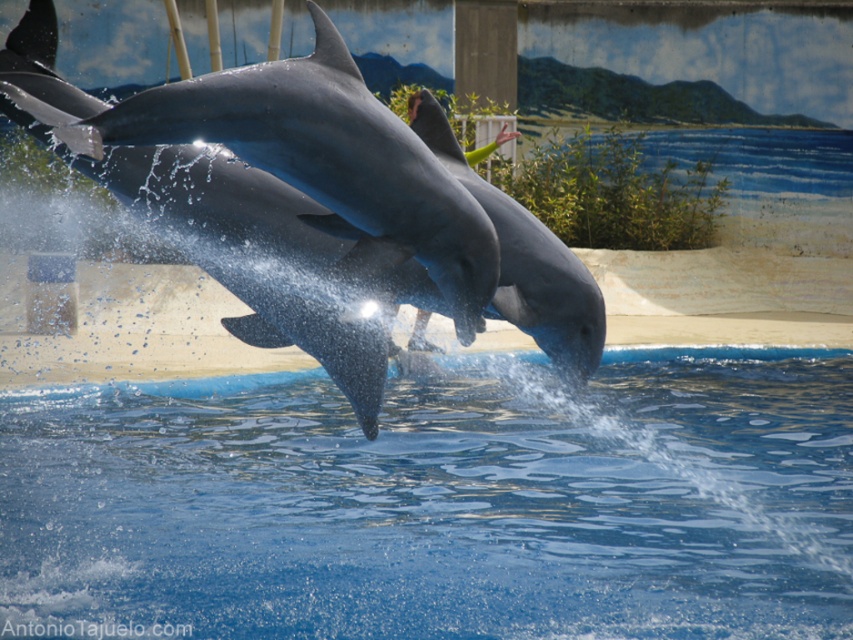
Question: Which point is farther from the camera taking this photo?

Choices:
 (A) (488, 188)
 (B) (143, 488)
 (C) (277, 131)

Answer: (B)

Question: Is blue smooth water at center to the left of shiny gray dolphin at center from the viewer's perspective?

Choices:
 (A) no
 (B) yes

Answer: (B)

Question: Estimate the real-world distances between objects in this image. Which object is closer to the shiny gray dolphin at center?

Choices:
 (A) blue smooth water at center
 (B) gray smooth dolphin at center

Answer: (B)

Question: Does blue smooth water at center have a lesser width compared to gray smooth dolphin at center?

Choices:
 (A) yes
 (B) no

Answer: (A)

Question: From the image, what is the correct spatial relationship of shiny gray dolphin at center in relation to gray smooth dolphin at center?

Choices:
 (A) right
 (B) left

Answer: (B)

Question: Which point is farther to the camera?

Choices:
 (A) (395, 176)
 (B) (497, 301)

Answer: (B)